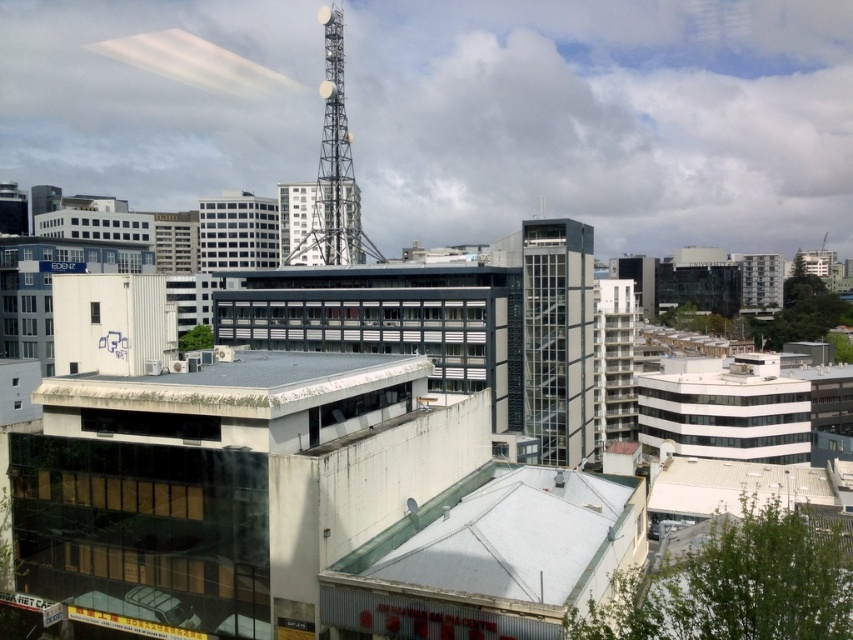
Question: Which point appears farthest from the camera in this image?

Choices:
 (A) (338, 83)
 (B) (408, 380)
 (C) (560, 417)

Answer: (A)

Question: Observing the image, what is the correct spatial positioning of white weathered roof at lower left in reference to metallic tower at upper center?

Choices:
 (A) right
 (B) left

Answer: (A)

Question: Estimate the real-world distances between objects in this image. Which object is closer to the glassy steel building at center?

Choices:
 (A) white weathered roof at lower left
 (B) metallic tower at upper center

Answer: (A)

Question: Is glassy steel building at center positioned at the back of white weathered roof at lower left?

Choices:
 (A) no
 (B) yes

Answer: (B)

Question: Which point is farther from the camera taking this photo?

Choices:
 (A) (521, 227)
 (B) (277, 401)
 (C) (323, 109)

Answer: (C)

Question: Is glassy steel building at center above metallic tower at upper center?

Choices:
 (A) yes
 (B) no

Answer: (B)